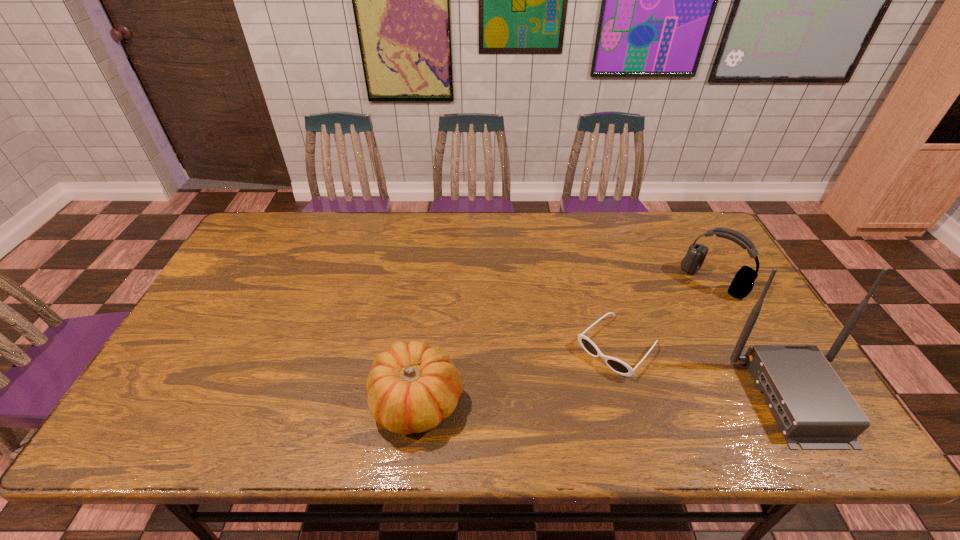
Locate an element on the screen. The width and height of the screenshot is (960, 540). vacant area that lies between the second shortest object and the sunglasses is located at coordinates click(x=517, y=374).

Where is `free area in between the second tallest object and the tallest object`? The height and width of the screenshot is (540, 960). free area in between the second tallest object and the tallest object is located at coordinates click(x=754, y=339).

You are a GUI agent. You are given a task and a screenshot of the screen. Output one action in this format:
    pyautogui.click(x=<x>, y=<y>)
    Task: Click on the free space between the router and the third tallest object
    
    Given the screenshot: What is the action you would take?
    pyautogui.click(x=606, y=399)

Identify which object is located as the nearest to the second object from left to right. Please provide its 2D coordinates. Your answer should be formatted as a tuple, i.e. [(x, y)], where the tuple contains the x and y coordinates of a point satisfying the conditions above.

[(813, 408)]

At what (x,y) coordinates should I click in order to perform the action: click on the third closest object to the gourd. Please return your answer as a coordinate pair (x, y). Image resolution: width=960 pixels, height=540 pixels. Looking at the image, I should click on (742, 284).

The height and width of the screenshot is (540, 960). Find the location of `vacant position in the image that satisfies the following two spatial constraints: 1. on the back side of the headset; 2. on the right side of the sunglasses`. vacant position in the image that satisfies the following two spatial constraints: 1. on the back side of the headset; 2. on the right side of the sunglasses is located at coordinates (599, 281).

You are a GUI agent. You are given a task and a screenshot of the screen. Output one action in this format:
    pyautogui.click(x=<x>, y=<y>)
    Task: Click on the free space that satisfies the following two spatial constraints: 1. on the back side of the leftmost object; 2. on the right side of the sunglasses
    
    Given the screenshot: What is the action you would take?
    pyautogui.click(x=423, y=347)

This screenshot has height=540, width=960. Find the location of `blank area in the image that satisfies the following two spatial constraints: 1. on the front side of the router; 2. on the back of the shortest object to connect cables`. blank area in the image that satisfies the following two spatial constraints: 1. on the front side of the router; 2. on the back of the shortest object to connect cables is located at coordinates (632, 396).

At what (x,y) coordinates should I click in order to perform the action: click on vacant space that satisfies the following two spatial constraints: 1. on the front side of the router; 2. on the back of the sunglasses to connect cables. Please return your answer as a coordinate pair (x, y). This screenshot has width=960, height=540. Looking at the image, I should click on (632, 396).